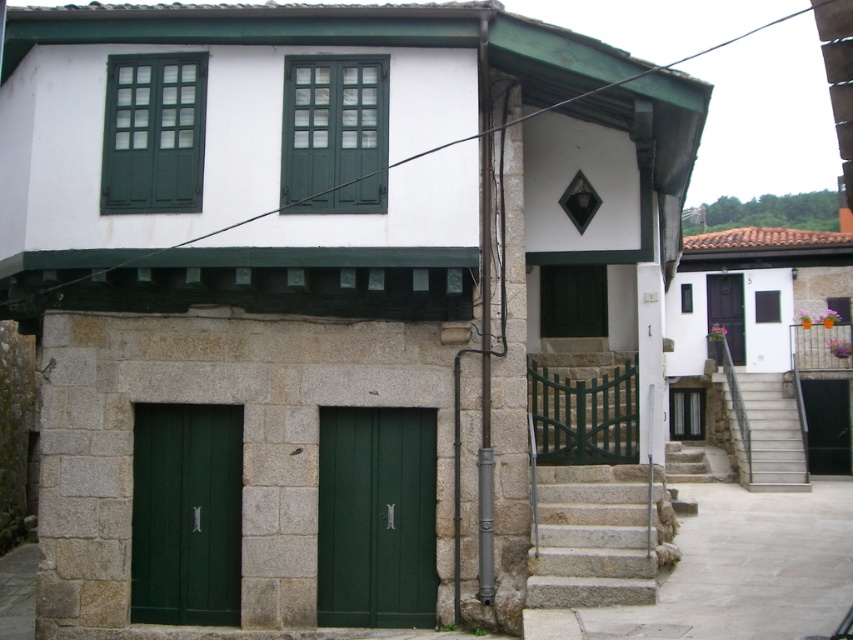
Question: Among these points, which one is farthest from the camera?

Choices:
 (A) (389, 588)
 (B) (793, 428)

Answer: (B)

Question: Is green matte window at upper left positioned at the back of black wooden door at center?

Choices:
 (A) no
 (B) yes

Answer: (A)

Question: Estimate the real-world distances between objects in this image. Which object is closer to the green matte window at upper center?

Choices:
 (A) green matte door at center
 (B) green matte window at upper left
 (C) granite steps at lower center

Answer: (B)

Question: Which of the following is the farthest from the observer?

Choices:
 (A) green matte window at upper center
 (B) green matte window at upper left

Answer: (B)

Question: Does green matte door at center appear over green matte window at upper left?

Choices:
 (A) yes
 (B) no

Answer: (B)

Question: Does green matte door at lower left have a lesser width compared to green matte window at upper left?

Choices:
 (A) yes
 (B) no

Answer: (B)